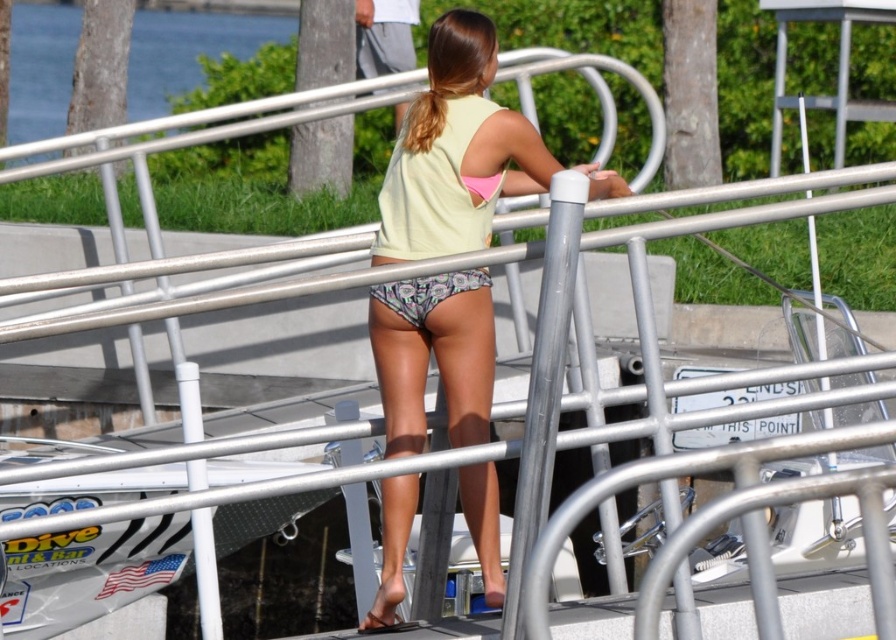
You are a photographer trying to capture the person on the metal railing. You notice the matte yellow tank top at center and the printed fabric bikini bottom at center. Which clothing item is closer to the camera?

The matte yellow tank top at center is closer to the camera since it is in front of the printed fabric bikini bottom at center.

In the scene shown: What are the coordinates of the matte yellow tank top at center?

The coordinates of the matte yellow tank top at center are at point (455, 150).